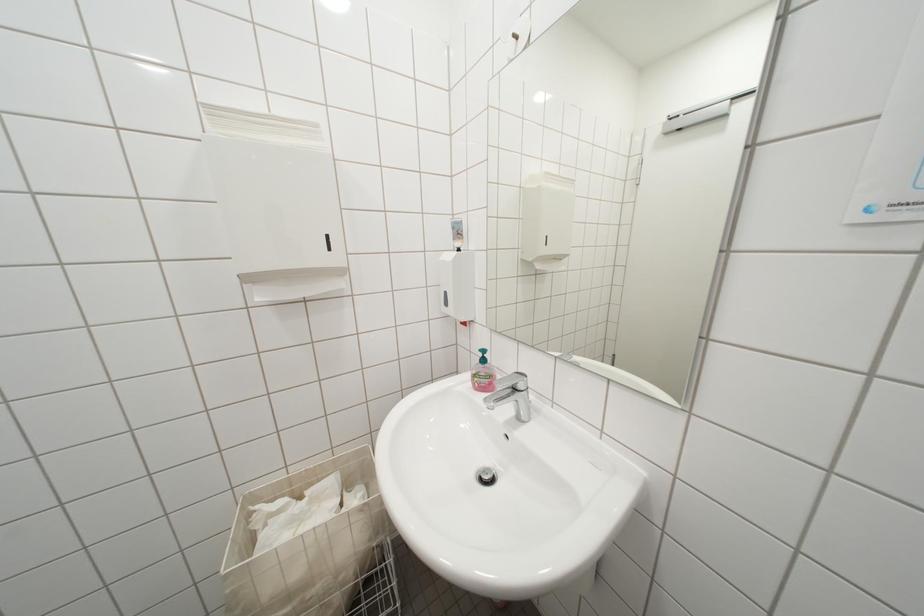
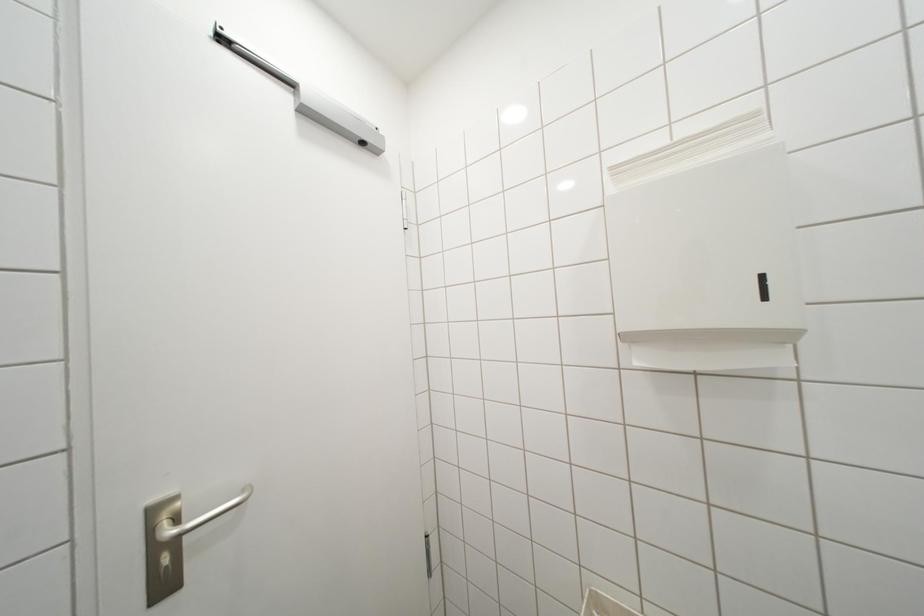
Question: The first image is from the beginning of the video and the second image is from the end. How did the camera likely rotate when shooting the video?

Choices:
 (A) Left
 (B) Right
 (C) Up
 (D) Down

Answer: (A)